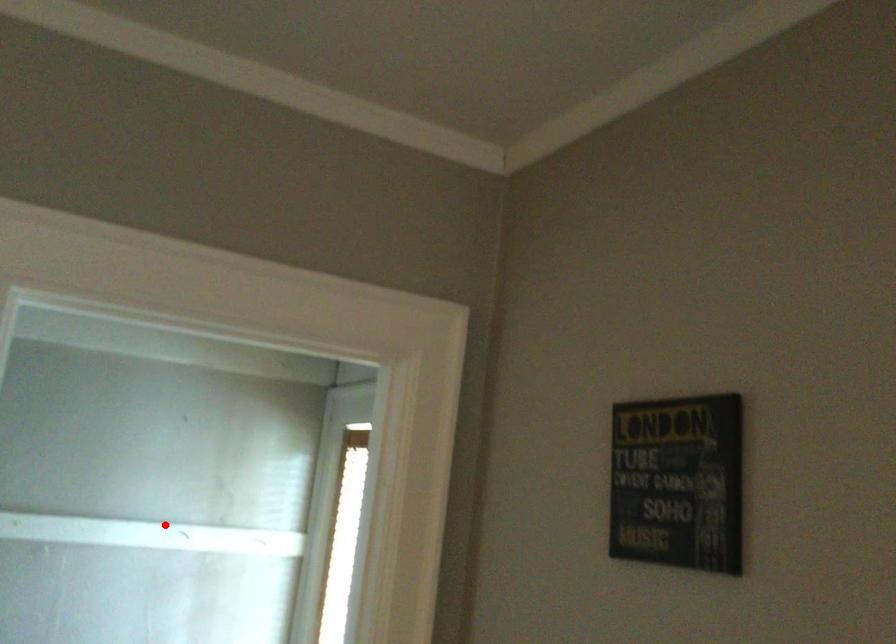
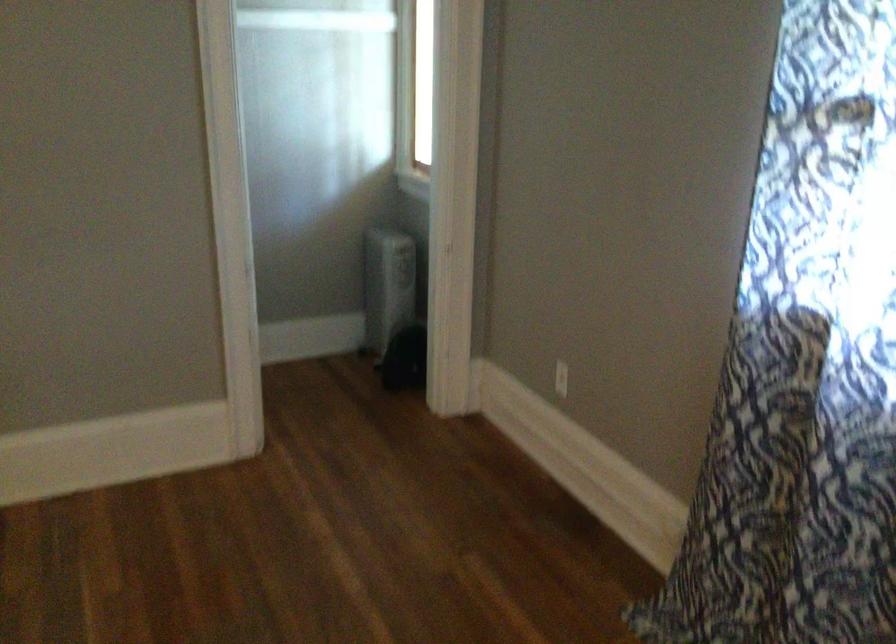
The point at the highlighted location is marked in the first image. Where is the corresponding point in the second image?

(313, 13)